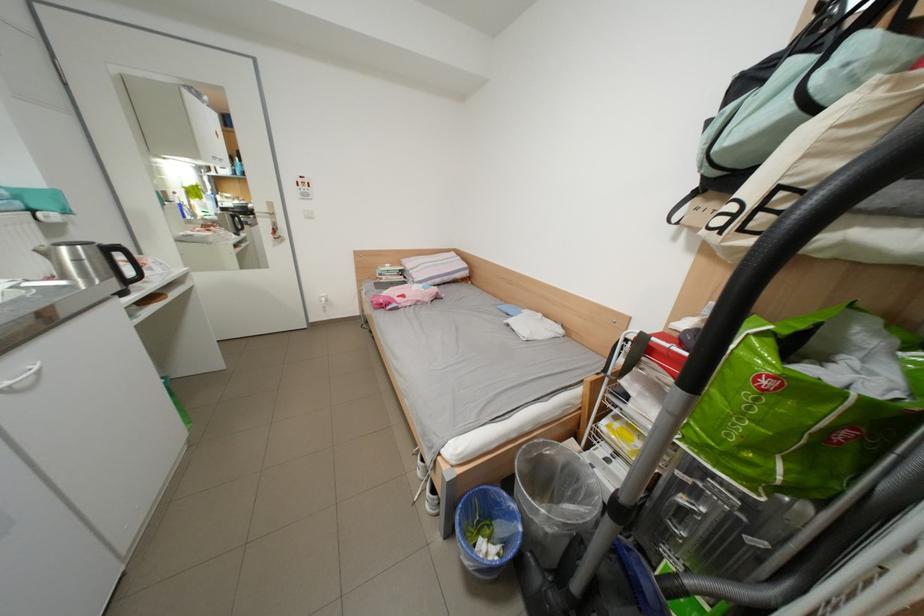
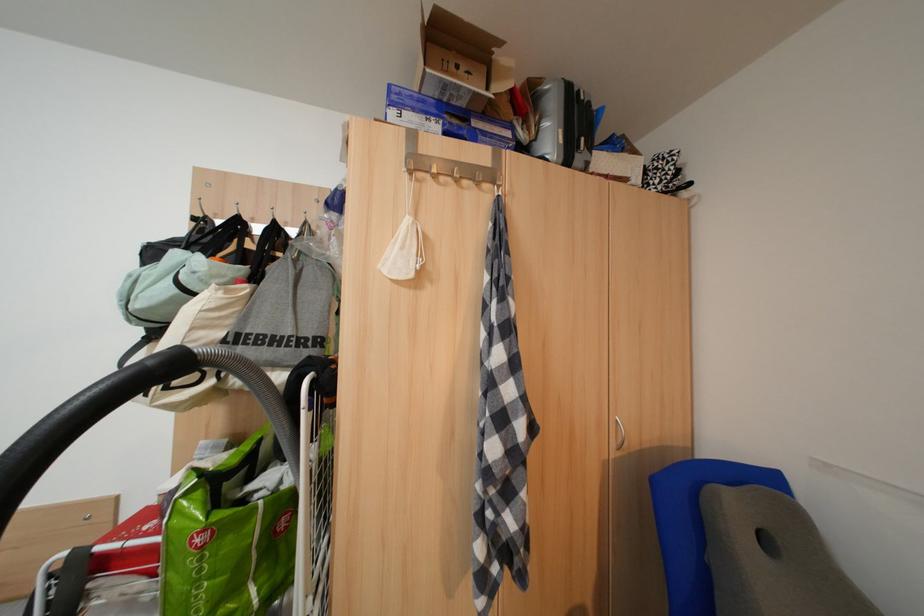
Question: The images are taken continuously from a first-person perspective. In which direction is your viewpoint rotating?

Choices:
 (A) Left
 (B) Right
 (C) Up
 (D) Down

Answer: (B)